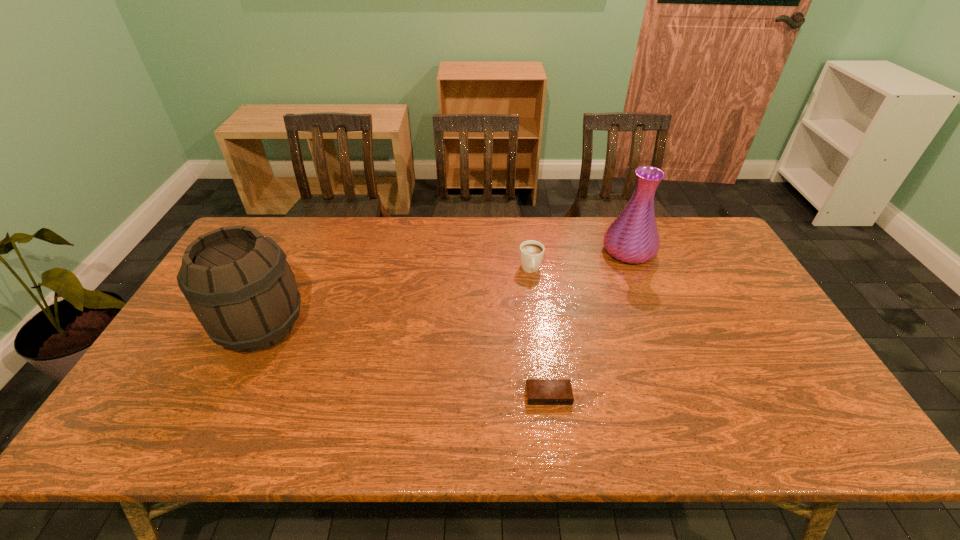
Identify which object is the third nearest to the shortest object. Please provide its 2D coordinates. Your answer should be formatted as a tuple, i.e. [(x, y)], where the tuple contains the x and y coordinates of a point satisfying the conditions above.

[(237, 281)]